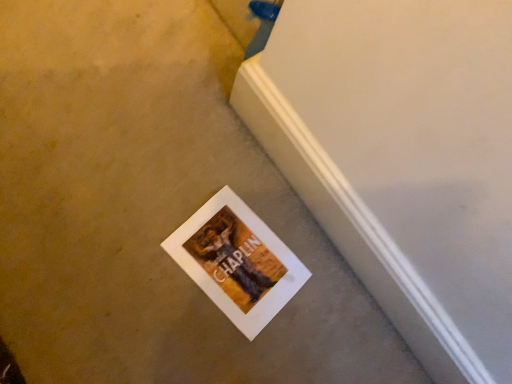
This screenshot has width=512, height=384. What are the coordinates of `free location above white matte picture frame at lower center (from a real-world perspective)` in the screenshot? It's located at (231, 256).